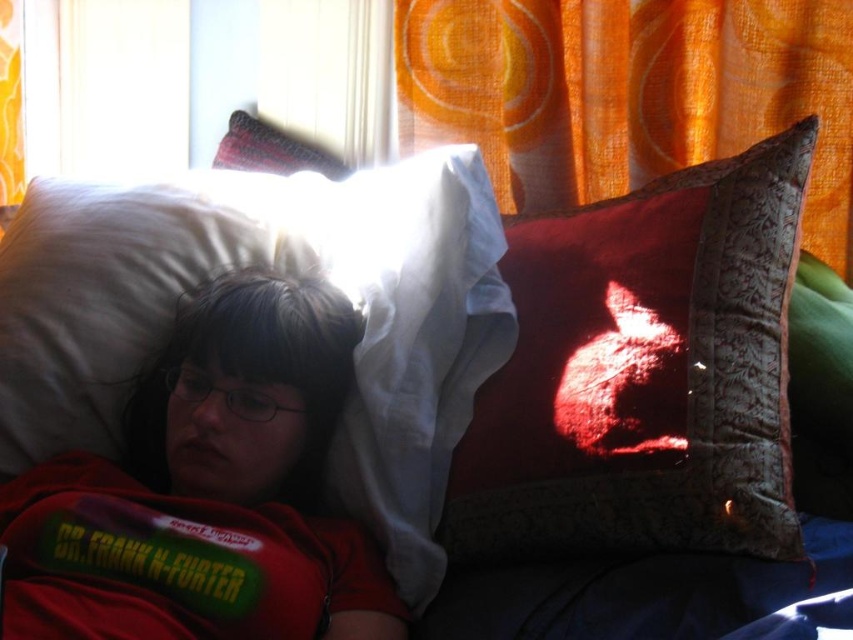
Question: Does velvet red pillow at upper right come behind velvet-like red pillow at upper left?

Choices:
 (A) no
 (B) yes

Answer: (A)

Question: Is orange sheer curtain at upper center bigger than velvet-like red pillow at upper left?

Choices:
 (A) no
 (B) yes

Answer: (B)

Question: Which of the following is the farthest from the observer?

Choices:
 (A) velvet-like red pillow at upper left
 (B) velvet-like red pillow at upper right

Answer: (A)

Question: Considering the real-world distances, which object is closest to the orange sheer curtain at upper center?

Choices:
 (A) velvet-like red pillow at upper right
 (B) velvet-like red pillow at upper left

Answer: (A)

Question: In this image, where is velvet red pillow at upper right located relative to orange sheer curtain at upper center?

Choices:
 (A) left
 (B) right

Answer: (A)

Question: Based on their relative distances, which object is farther from the velvet-like red pillow at upper left?

Choices:
 (A) velvet red pillow at upper right
 (B) orange sheer curtain at upper center

Answer: (A)